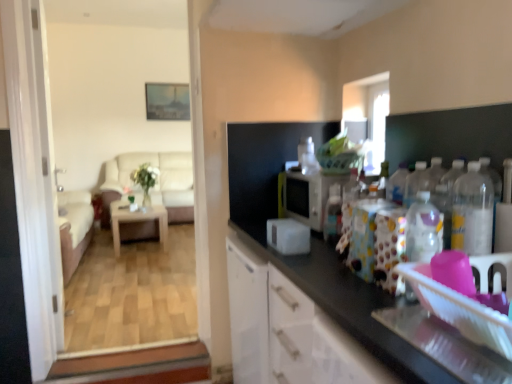
Question: Is white glossy screen door at left, the 1th screen door when ordered from right to left, in front of or behind translucent plastic bottle at center, the 1th bottle positioned from the back, in the image?

Choices:
 (A) behind
 (B) front

Answer: (A)

Question: Looking at the image, does white glossy screen door at left, the 1th screen door when ordered from right to left, seem bigger or smaller compared to translucent plastic bottle at center, the 3th bottle when ordered from front to back?

Choices:
 (A) big
 (B) small

Answer: (A)

Question: Based on their relative distances, which object is farther from the white matte cabinet at center?

Choices:
 (A) wooden table at center
 (B) translucent plastic bottle at center, the 3th bottle when ordered from front to back
 (C) green glass vase at center
 (D) white glossy door at left, positioned as the 1th screen door in left-to-right order
 (E) white plastic toaster at center, the second appliance viewed from the back

Answer: (C)

Question: Based on their relative distances, which object is nearer to the white plastic toaster at center, the second appliance viewed from the back?

Choices:
 (A) white matte cabinet at center
 (B) translucent plastic bottle at center, which is counted as the 3th bottle, starting from the right
 (C) clear plastic bottle at right, positioned as the 2th bottle in back-to-front order
 (D) wooden table at center
 (E) white glossy screen door at left, marked as the 2th screen door in a left-to-right arrangement

Answer: (B)